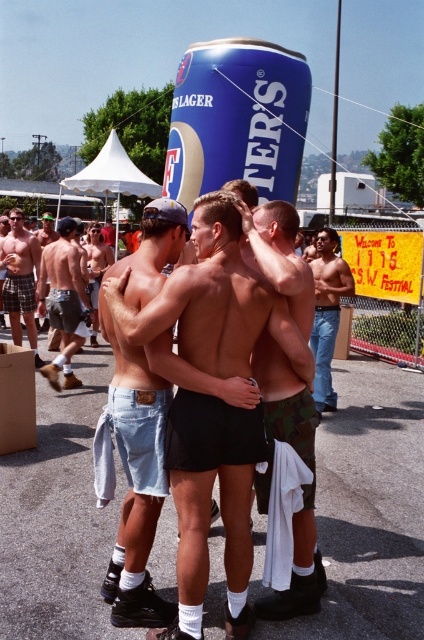
Question: Can you confirm if black matte shorts at center is bigger than plaid shorts at left?

Choices:
 (A) no
 (B) yes

Answer: (B)

Question: Which point appears farthest from the camera in this image?

Choices:
 (A) (19, 308)
 (B) (173, 458)
 (C) (47, 244)

Answer: (A)

Question: Which point appears closest to the camera in this image?

Choices:
 (A) (268, 484)
 (B) (243, 166)

Answer: (A)

Question: Can you confirm if black matte shorts at center is positioned below camo-patterned shorts at center?

Choices:
 (A) no
 (B) yes

Answer: (B)

Question: Is black matte shorts at center behind blue matte beer can at center?

Choices:
 (A) no
 (B) yes

Answer: (A)

Question: Considering the real-world distances, which object is closest to the blue matte beer can at center?

Choices:
 (A) plaid shorts at left
 (B) camo-patterned shorts at center

Answer: (A)